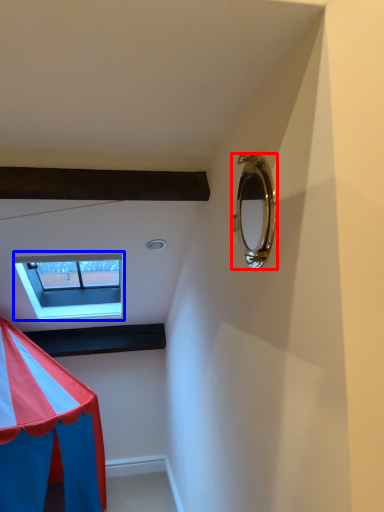
Question: Which of the following is the farthest to the observer, mirror (highlighted by a red box) or window (highlighted by a blue box)?

Choices:
 (A) mirror
 (B) window

Answer: (B)